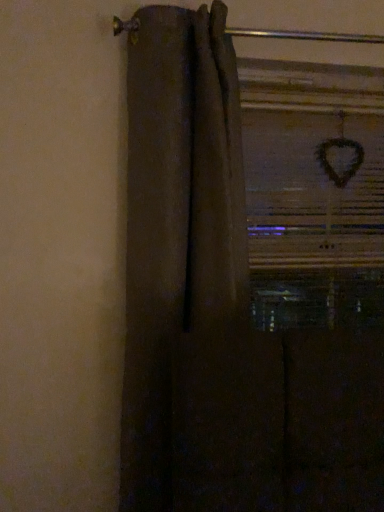
Question: Should I look upward or downward to see brown fabric curtain at left?

Choices:
 (A) down
 (B) up

Answer: (A)